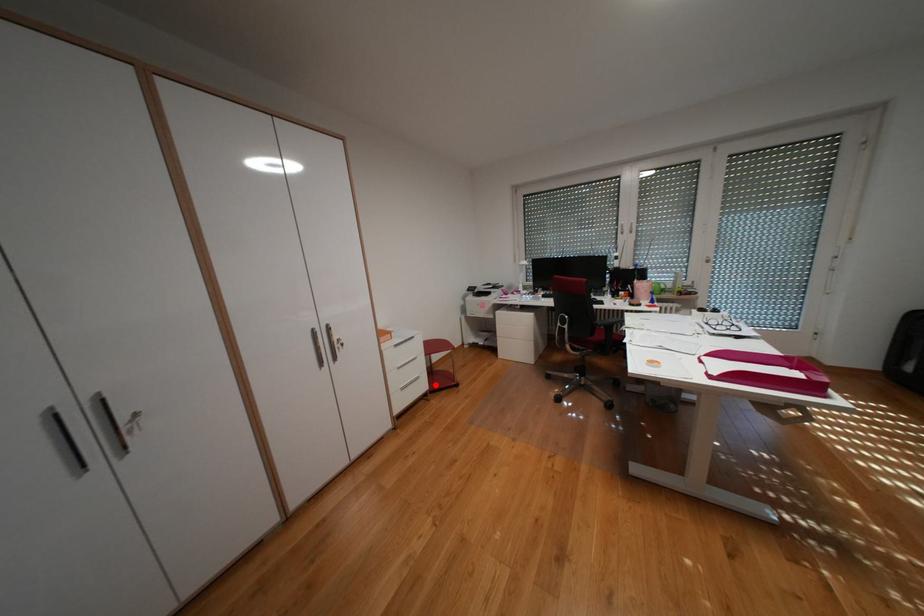
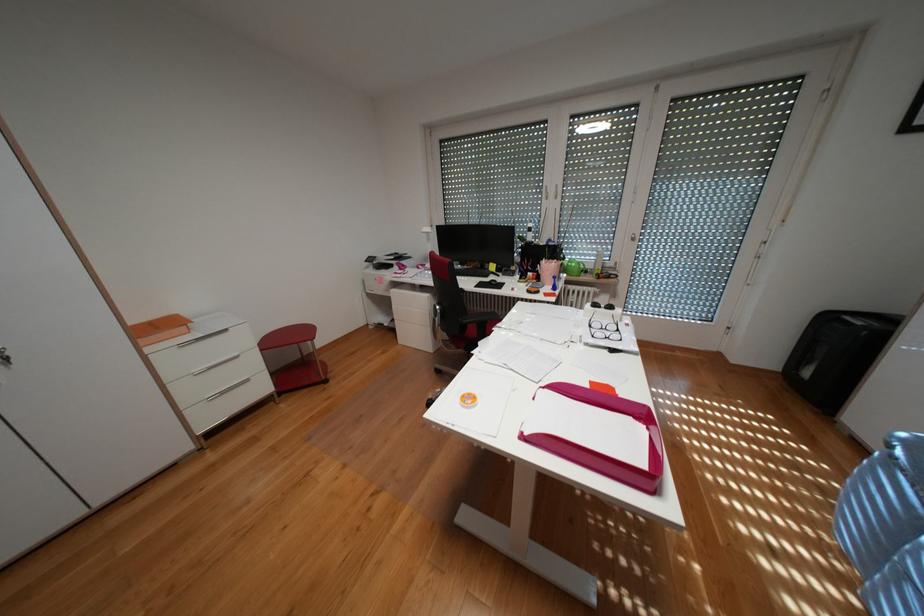
Question: I am providing you with two images of the same scene from different viewpoints. A red point is shown in image1. For the corresponding object point in image2, is it positioned nearer or farther from the camera?

Choices:
 (A) Nearer
 (B) Farther

Answer: (B)